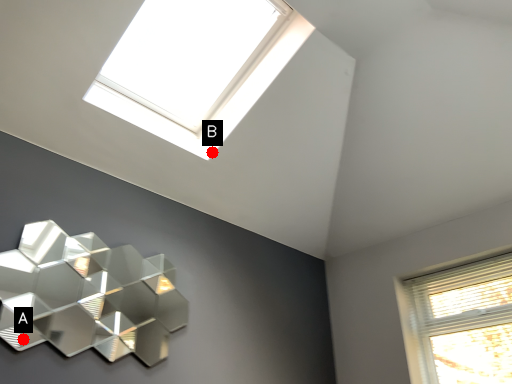
Question: Two points are circled on the image, labeled by A and B beside each circle. Which point is further to the camera?

Choices:
 (A) A is further
 (B) B is further

Answer: (B)